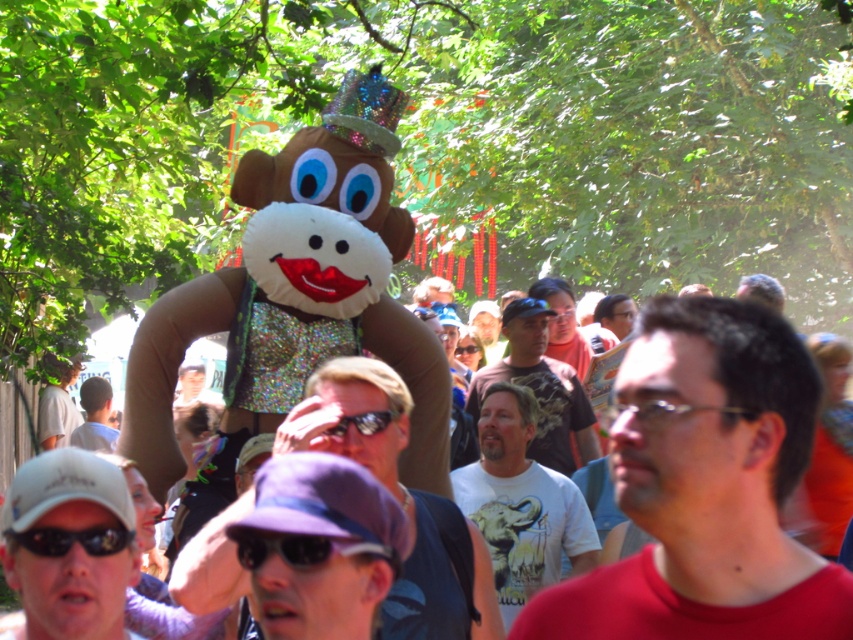
Between point (756, 480) and point (483, 554), which one is positioned behind?

The point (483, 554) is more distant.

Does point (680, 474) come behind point (322, 417)?

No, it is not.

What are the coordinates of `matte red shirt at center` in the screenshot? It's located at (706, 486).

Between white matte cap at lower left and bearded man at center, which one is positioned lower?

white matte cap at lower left is below.

Between white matte cap at lower left and bearded man at center, which one appears on the left side from the viewer's perspective?

Positioned to the left is white matte cap at lower left.

At what (x,y) coordinates should I click in order to perform the action: click on white matte cap at lower left. Please return your answer as a coordinate pair (x, y). Looking at the image, I should click on (68, 545).

Where is `white matte cap at lower left`? white matte cap at lower left is located at coordinates (68, 545).

Can you confirm if white matte cap at lower left is smaller than white t-shirt with elephant graphic at center?

Indeed, white matte cap at lower left has a smaller size compared to white t-shirt with elephant graphic at center.

Where is `white matte cap at lower left`? Image resolution: width=853 pixels, height=640 pixels. white matte cap at lower left is located at coordinates (68, 545).

You are a GUI agent. You are given a task and a screenshot of the screen. Output one action in this format:
    pyautogui.click(x=<x>, y=<y>)
    Task: Click on the white matte cap at lower left
    This screenshot has height=640, width=853.
    Given the screenshot: What is the action you would take?
    pyautogui.click(x=68, y=545)